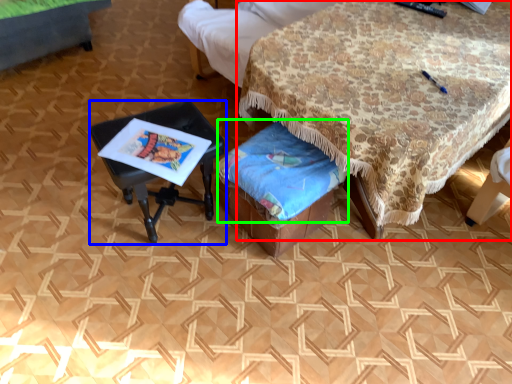
Question: Which object is the farthest from table (highlighted by a red box)? Choose among these: table (highlighted by a blue box) or blanket (highlighted by a green box).

Choices:
 (A) table
 (B) blanket

Answer: (A)